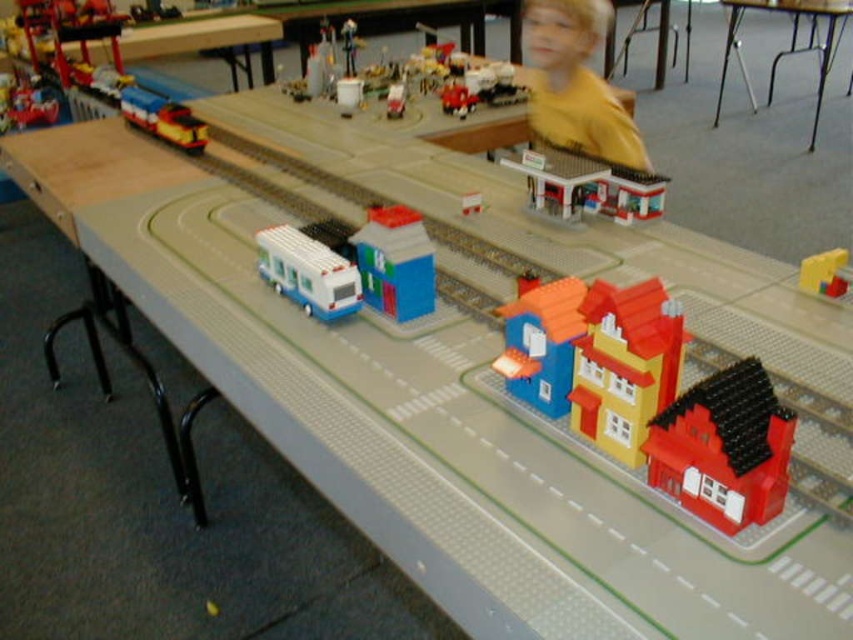
You are a model train enthusiast examining the setup. You notice two points marked on the table. The first point is at coordinate (370, 248) and the second is at (474, 97). Based on your observation, which point is closer to the camera?

Point (370, 248) is closer to the camera than point (474, 97).